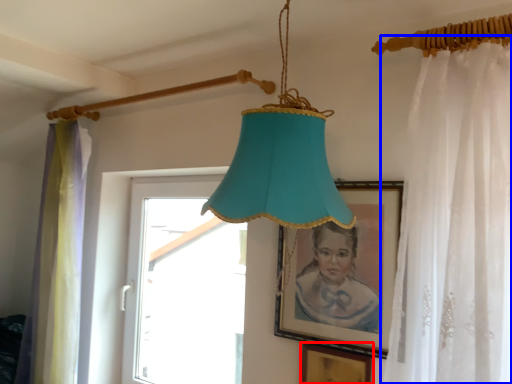
Question: Which point is further to the camera, picture frame (highlighted by a red box) or curtain (highlighted by a blue box)?

Choices:
 (A) picture frame
 (B) curtain

Answer: (A)